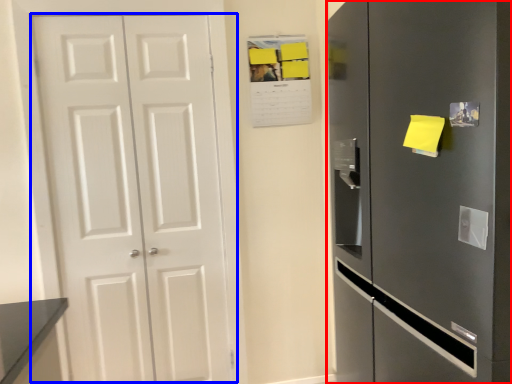
Question: Which object appears farthest to the camera in this image, refrigerator (highlighted by a red box) or door (highlighted by a blue box)?

Choices:
 (A) refrigerator
 (B) door

Answer: (B)